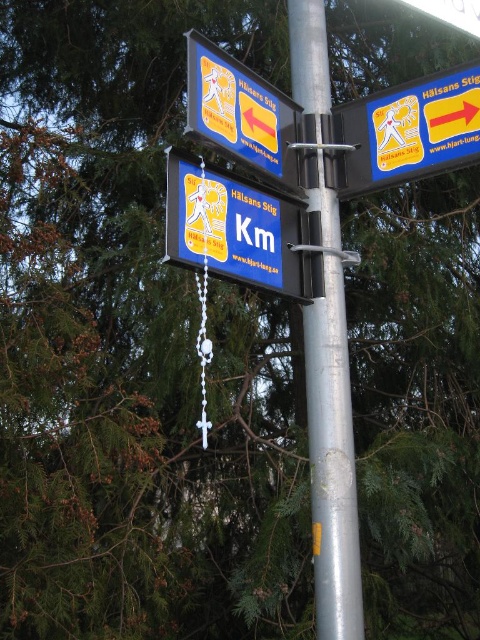
Question: Does silver metallic pole at center have a smaller size compared to yellow plastic sign at upper center?

Choices:
 (A) yes
 (B) no

Answer: (B)

Question: Which object is closer to the camera taking this photo?

Choices:
 (A) blue plastic sign at center
 (B) blue plastic sign at upper right
 (C) silver metallic pole at center
 (D) yellow plastic sign at upper center

Answer: (A)

Question: Is blue plastic sign at center above blue plastic sign at upper right?

Choices:
 (A) no
 (B) yes

Answer: (A)

Question: In this image, where is blue plastic sign at center located relative to yellow plastic sign at upper center?

Choices:
 (A) below
 (B) above

Answer: (A)

Question: Estimate the real-world distances between objects in this image. Which object is farther from the blue plastic sign at upper right?

Choices:
 (A) blue plastic sign at center
 (B) silver metallic pole at center
 (C) yellow plastic sign at upper center

Answer: (A)

Question: Among these objects, which one is farthest from the camera?

Choices:
 (A) blue plastic sign at upper right
 (B) silver metallic pole at center
 (C) yellow plastic sign at upper center

Answer: (A)